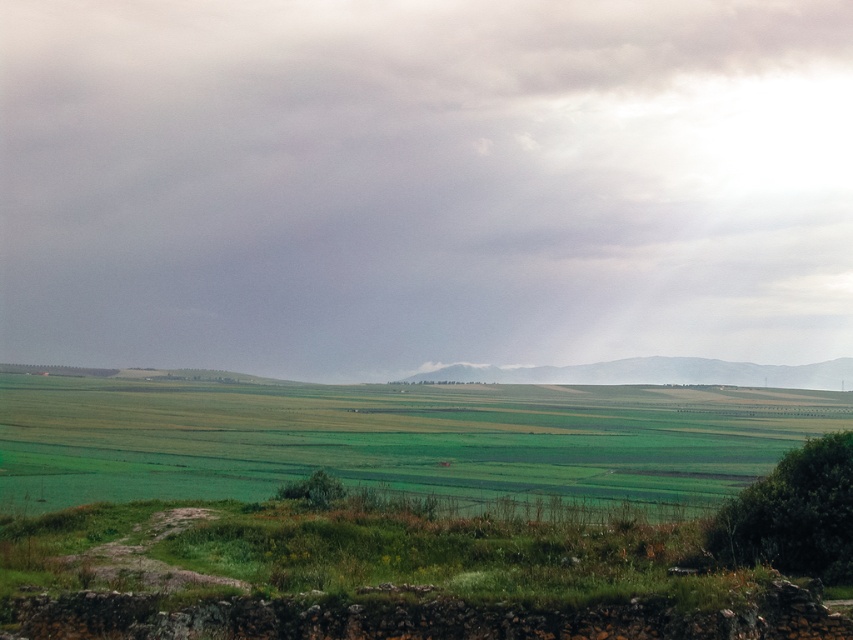
You are a landscape photographer planning to capture the cloudy sky at upper center and the green grassy field at lower center in a single frame. Based on their sizes in the image, which one would occupy more of the camera view?

The cloudy sky at upper center has a larger size compared to the green grassy field at lower center, so it would occupy more of the camera view.

You are standing in the middle of the open landscape looking at the point marked by point [422,182]. What part of the scene does this point indicate?

The point [422,182] indicates the cloudy sky at upper center.